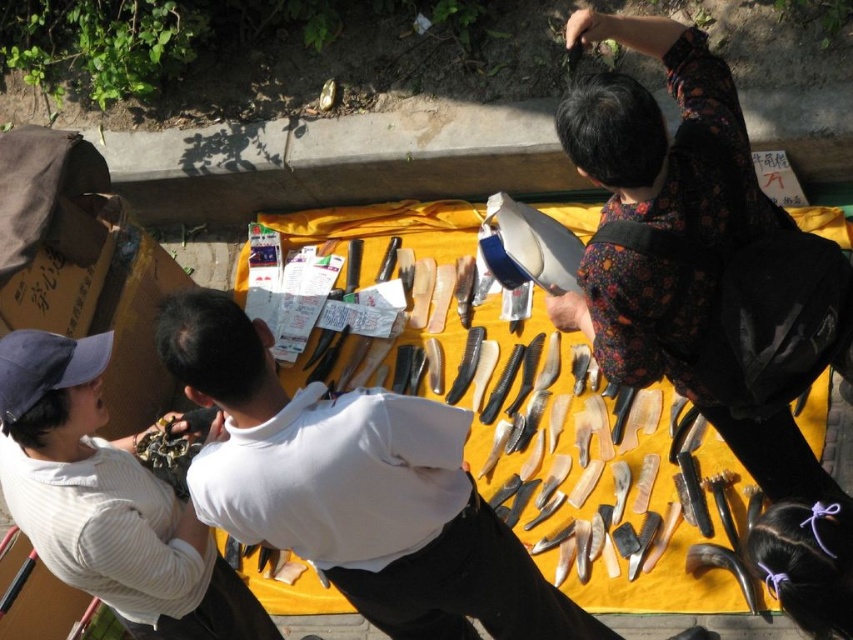
Question: Which of the following is the closest to the observer?

Choices:
 (A) (157, 321)
 (B) (334, 365)

Answer: (A)

Question: Estimate the real-world distances between objects in this image. Which object is closer to the white matte shirt at upper left?

Choices:
 (A) black leather shoe at lower right
 (B) yellow fabric at center
 (C) white matte shirt at center

Answer: (C)

Question: Does white matte shirt at center appear on the right side of black leather shoe at lower right?

Choices:
 (A) yes
 (B) no

Answer: (B)

Question: Observing the image, what is the correct spatial positioning of yellow fabric at center in reference to black leather shoe at lower right?

Choices:
 (A) right
 (B) left

Answer: (B)

Question: Estimate the real-world distances between objects in this image. Which object is closer to the yellow fabric at center?

Choices:
 (A) black leather shoe at lower right
 (B) white matte shirt at center

Answer: (A)

Question: Does yellow fabric at center have a smaller size compared to white matte shirt at upper left?

Choices:
 (A) yes
 (B) no

Answer: (B)